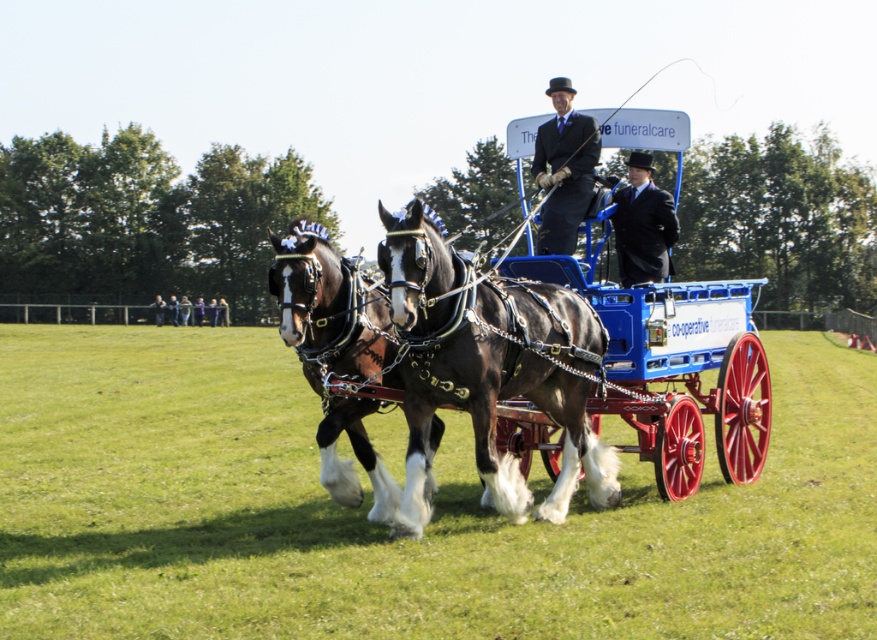
Question: Does dark blue suit at center lie behind light brown leather jacket at center?

Choices:
 (A) yes
 (B) no

Answer: (B)

Question: Is shiny brown horse at center wider than matte black suit at center?

Choices:
 (A) yes
 (B) no

Answer: (A)

Question: Which object appears closest to the camera in this image?

Choices:
 (A) smooth leather jacket at center
 (B) brown glossy horse at center
 (C) light brown leather jacket at center

Answer: (B)

Question: Is shiny blue cart at center positioned before black wool coat at center?

Choices:
 (A) yes
 (B) no

Answer: (A)

Question: Among these points, which one is farthest from the camera?

Choices:
 (A) (574, 144)
 (B) (160, 305)
 (C) (195, 301)

Answer: (C)

Question: Which object appears closest to the camera in this image?

Choices:
 (A) dark blue suit at center
 (B) smooth leather jacket at center
 (C) shiny black horse at center
 (D) dark blue suit at lower left

Answer: (C)